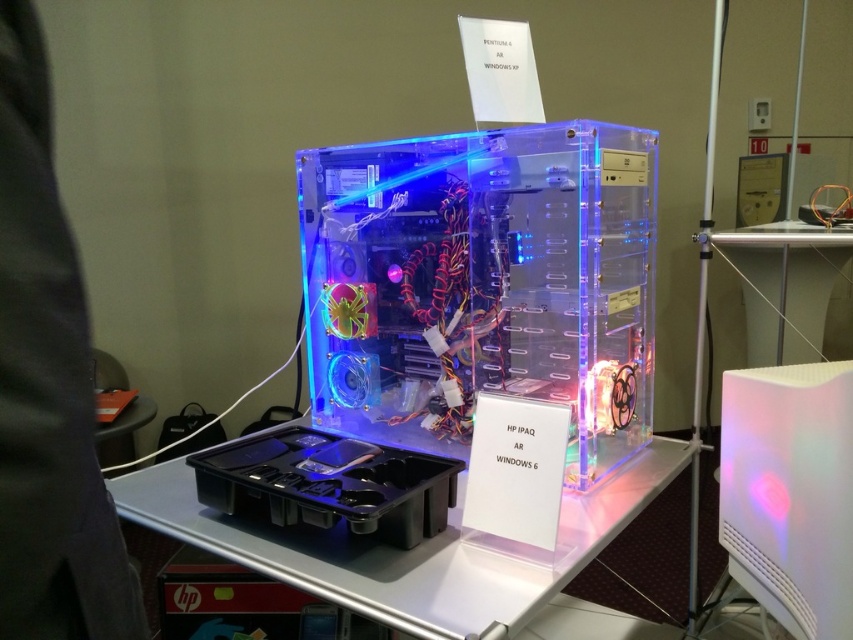
Question: Does clear plastic tray at center have a greater width compared to translucent plastic tray at center?

Choices:
 (A) yes
 (B) no

Answer: (A)

Question: Which object is positioned farthest from the white glossy table at center?

Choices:
 (A) clear plastic tray at center
 (B) translucent plastic tray at center

Answer: (B)

Question: Is clear plastic tray at center wider than white glossy table at center?

Choices:
 (A) yes
 (B) no

Answer: (A)

Question: Among these points, which one is farthest from the camera?

Choices:
 (A) (756, 236)
 (B) (428, 493)
 (C) (508, 577)

Answer: (A)

Question: Does clear plastic tray at center appear over translucent plastic tray at center?

Choices:
 (A) yes
 (B) no

Answer: (B)

Question: Which of the following is the farthest from the observer?

Choices:
 (A) translucent plastic tray at center
 (B) clear plastic tray at center
 (C) white glossy table at center

Answer: (C)